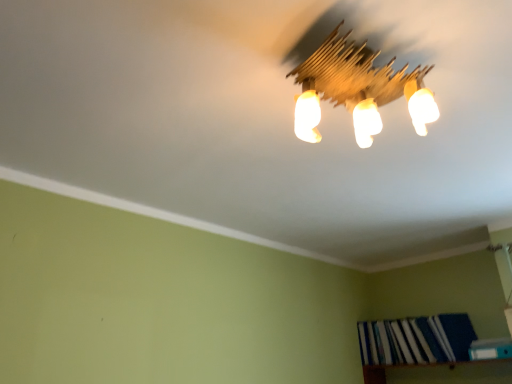
Question: Should I look upward or downward to see wooden bookshelf at lower right?

Choices:
 (A) up
 (B) down

Answer: (B)

Question: Is wooden bookshelf at lower right at the right side of blue hardcover book at lower right, acting as the 1th book starting from the back?

Choices:
 (A) no
 (B) yes

Answer: (B)

Question: Is wooden bookshelf at lower right smaller than blue hardcover book at lower right, which is counted as the 2th book, starting from the front?

Choices:
 (A) yes
 (B) no

Answer: (A)

Question: Does wooden bookshelf at lower right appear on the left side of blue hardcover book at lower right, acting as the 1th book starting from the back?

Choices:
 (A) yes
 (B) no

Answer: (B)

Question: Considering the relative positions of wooden bookshelf at lower right and blue hardcover book at lower right, acting as the 1th book starting from the back, in the image provided, is wooden bookshelf at lower right in front of blue hardcover book at lower right, acting as the 1th book starting from the back,?

Choices:
 (A) no
 (B) yes

Answer: (B)

Question: Does wooden bookshelf at lower right come behind blue hardcover book at lower right, acting as the 1th book starting from the back?

Choices:
 (A) yes
 (B) no

Answer: (B)

Question: Is wooden bookshelf at lower right oriented away from blue hardcover book at lower right, which is counted as the 2th book, starting from the front?

Choices:
 (A) yes
 (B) no

Answer: (B)

Question: Is wooden bookshelf at lower right oriented away from blue fabric book at lower right, arranged as the 2th book when viewed from the back?

Choices:
 (A) yes
 (B) no

Answer: (B)

Question: Does wooden bookshelf at lower right have a lesser height compared to blue fabric book at lower right, arranged as the 2th book when viewed from the back?

Choices:
 (A) yes
 (B) no

Answer: (B)

Question: Is wooden bookshelf at lower right far away from blue fabric book at lower right, arranged as the first book when viewed from the front?

Choices:
 (A) no
 (B) yes

Answer: (A)

Question: From a real-world perspective, is wooden bookshelf at lower right beneath blue fabric book at lower right, arranged as the 2th book when viewed from the back?

Choices:
 (A) no
 (B) yes

Answer: (B)

Question: Can you confirm if wooden bookshelf at lower right is taller than blue fabric book at lower right, arranged as the 2th book when viewed from the back?

Choices:
 (A) yes
 (B) no

Answer: (A)

Question: Is wooden bookshelf at lower right with blue fabric book at lower right, arranged as the first book when viewed from the front?

Choices:
 (A) no
 (B) yes

Answer: (A)

Question: Is wooden bookshelf at lower right completely or partially inside wooden light fixture at upper center?

Choices:
 (A) no
 (B) yes

Answer: (A)